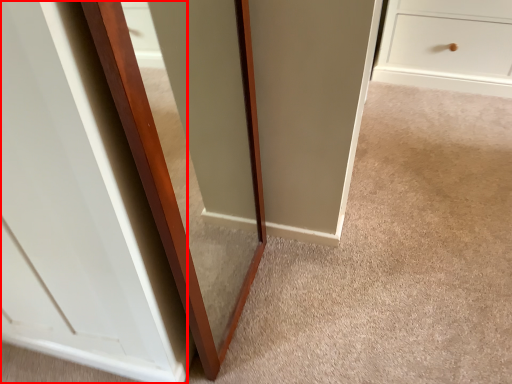
Question: Where is glass door (annotated by the red box) located in relation to glass door in the image?

Choices:
 (A) right
 (B) left

Answer: (B)